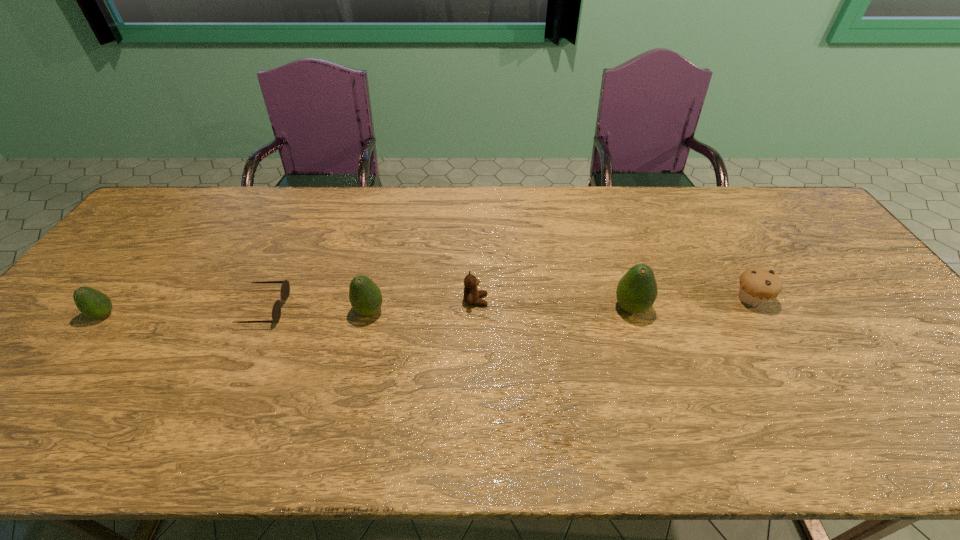
Given the evenly spaced avocados in the image, where should an extra avocado be added on the right to preserve the spacing? Please point to a vacant space. Please provide its 2D coordinates. Your answer should be formatted as a tuple, i.e. [(x, y)], where the tuple contains the x and y coordinates of a point satisfying the conditions above.

[(888, 305)]